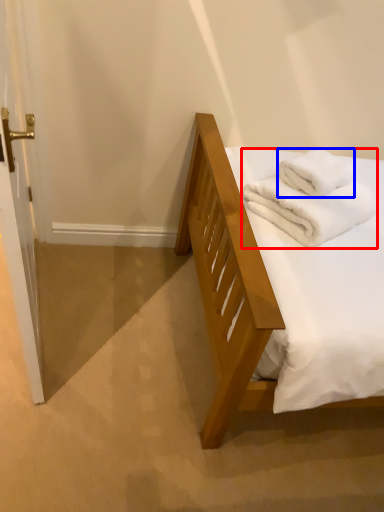
Question: Which of the following is the farthest to the observer, bath towel (highlighted by a red box) or bath towel (highlighted by a blue box)?

Choices:
 (A) bath towel
 (B) bath towel

Answer: (B)